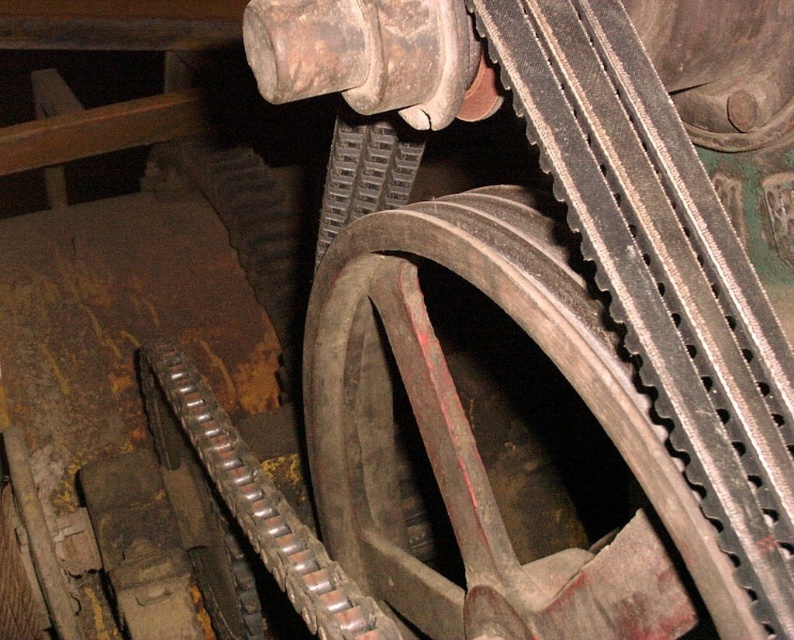
You are an engineer inspecting the mechanical components. You notice the rusty metal gear at center and the rusty metal wheel at center. Which one is closer to you?

The rusty metal gear at center is closer to you because it is in front of the rusty metal wheel at center.

Based on the scene description, which object is taller between the rusty metal gear at center and the rusty metal wheel at center?

The rusty metal gear at center is much taller than the rusty metal wheel at center.